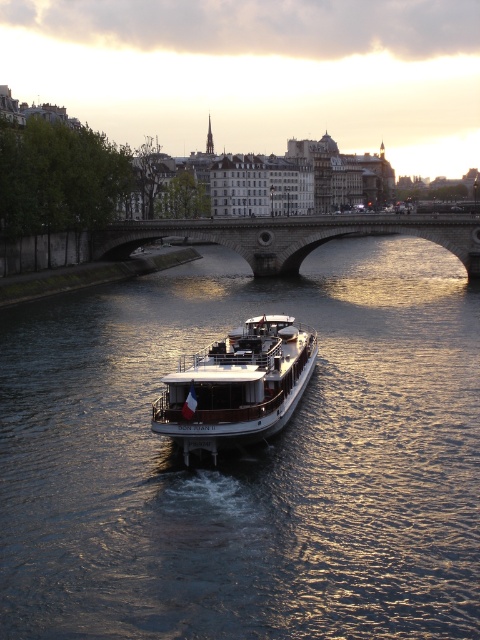
You are standing on the upper deck of the Don Juan II river cruise boat and looking towards the center of the image. What do you see at the coordinates point (247, 458)?

At the coordinates point (247, 458), you see shiny dark water at center.

You are a photographer planning to capture the entire scene of the shiny dark water at center and the white polished wood boat at center in one shot. Given that your camera has a limited field of view, which object should you prioritize framing first to ensure both are visible?

Since the shiny dark water at center is larger in size than the white polished wood boat at center, you should prioritize framing the shiny dark water at center first to accommodate its larger size, then adjust to include the smaller white polished wood boat at center.

You are a photographer planning to take a photo of the white polished wood boat at center and the stone arch bridge at center. Since you want the boat to appear closer to the camera than the bridge in the photo, which object should you position closer to the camera?

The white polished wood boat at center should be positioned closer to the camera since it is already in front of the stone arch bridge at center, making it naturally appear closer in the photo.